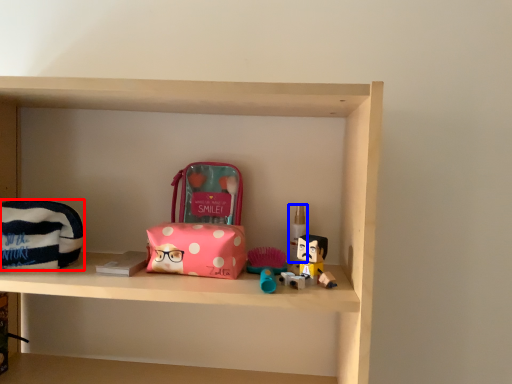
Question: Among these objects, which one is nearest to the camera, pouch (highlighted by a red box) or toiletry (highlighted by a blue box)?

Choices:
 (A) pouch
 (B) toiletry

Answer: (A)